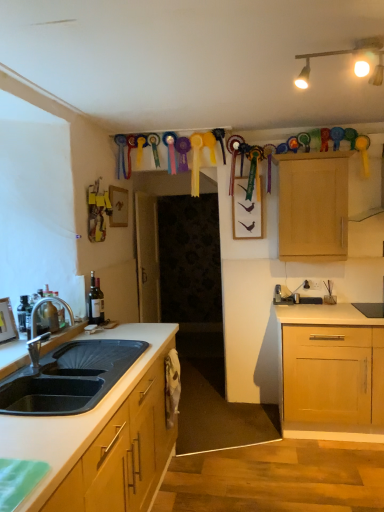
What are the coordinates of `empty space that is ontop of matte gold track lights at upper center (from a real-world perspective)` in the screenshot? It's located at (354, 41).